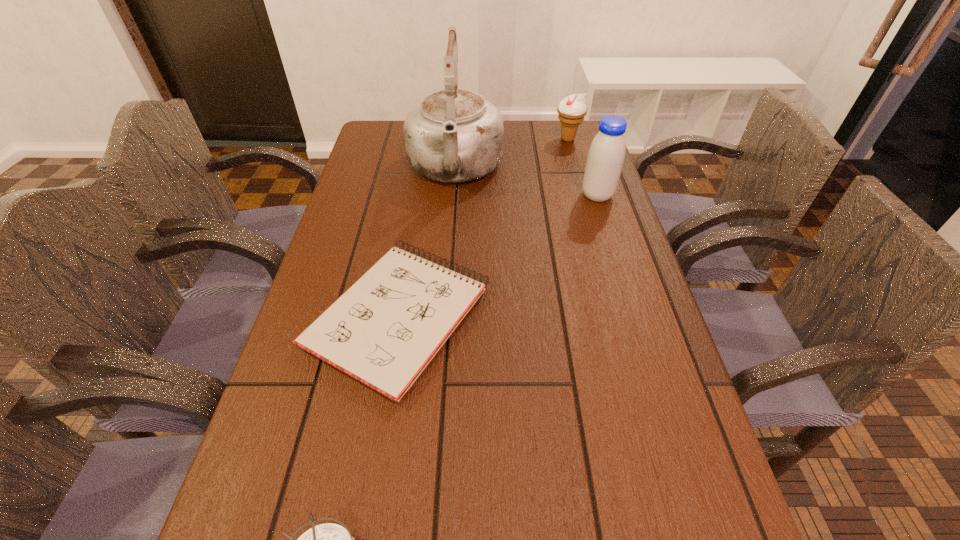
Find the location of a particular element. The image size is (960, 540). kettle is located at coordinates (454, 135).

At what (x,y) coordinates should I click in order to perform the action: click on the fourth shortest object. Please return your answer as a coordinate pair (x, y). The image size is (960, 540). Looking at the image, I should click on (606, 155).

The image size is (960, 540). In order to click on icecream in this screenshot , I will do `click(572, 109)`.

Image resolution: width=960 pixels, height=540 pixels. I want to click on the fourth farthest object, so click(383, 331).

At what (x,y) coordinates should I click in order to perform the action: click on notepad. Please return your answer as a coordinate pair (x, y). Looking at the image, I should click on (383, 331).

Where is `vacant space positioned at the spout of the kettle`? vacant space positioned at the spout of the kettle is located at coordinates (447, 274).

This screenshot has width=960, height=540. Find the location of `vacant space situated 0.110m on the back of the soya milk`. vacant space situated 0.110m on the back of the soya milk is located at coordinates (588, 165).

This screenshot has width=960, height=540. Find the location of `vacant space located 0.330m on the front of the icecream`. vacant space located 0.330m on the front of the icecream is located at coordinates (588, 210).

Find the location of a particular element. This screenshot has height=540, width=960. free location located on the front of the shortest object is located at coordinates (370, 492).

You are a GUI agent. You are given a task and a screenshot of the screen. Output one action in this format:
    pyautogui.click(x=<x>, y=<y>)
    Task: Click on the kettle that is at the far edge
    
    Given the screenshot: What is the action you would take?
    pyautogui.click(x=454, y=135)